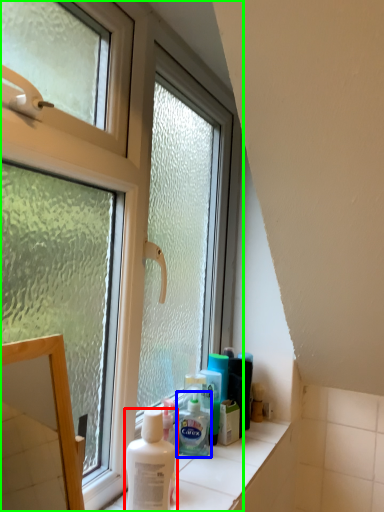
Question: Based on their relative distances, which object is farther from shaving cream (highlighted by a red box)? Choose from shaving cream (highlighted by a blue box) and window (highlighted by a green box).

Choices:
 (A) shaving cream
 (B) window

Answer: (B)